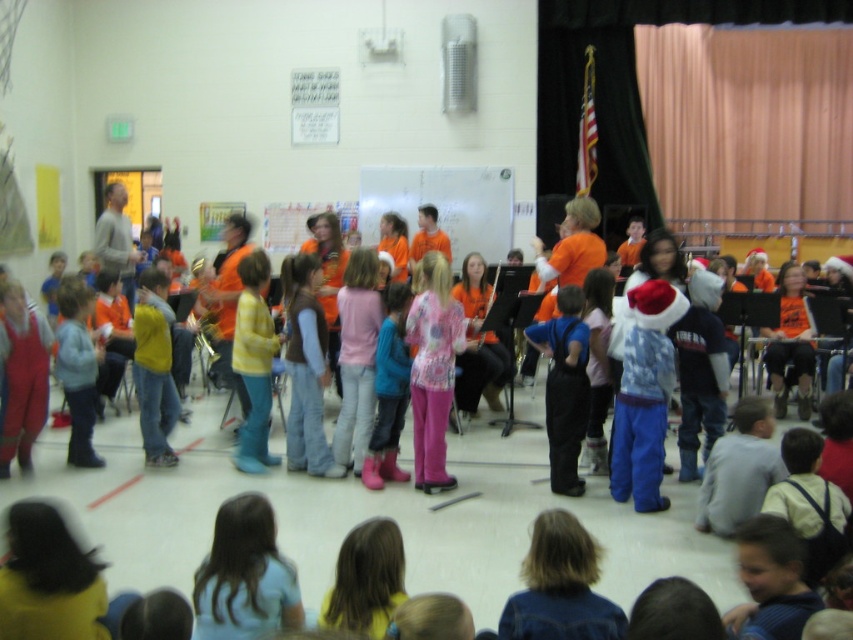
Between blue denim overalls at center and pink rubber boots at center, which one is positioned lower?

Positioned lower is blue denim overalls at center.

Which is in front, point (547, 388) or point (387, 417)?

Point (547, 388) is in front.

Between point (567, 452) and point (386, 428), which one is positioned behind?

The point (386, 428) is more distant.

Image resolution: width=853 pixels, height=640 pixels. Identify the location of blue denim overalls at center. (564, 387).